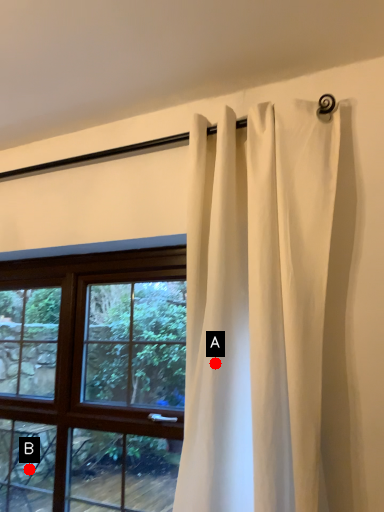
Question: Two points are circled on the image, labeled by A and B beside each circle. Among these points, which one is nearest to the camera?

Choices:
 (A) A is closer
 (B) B is closer

Answer: (A)